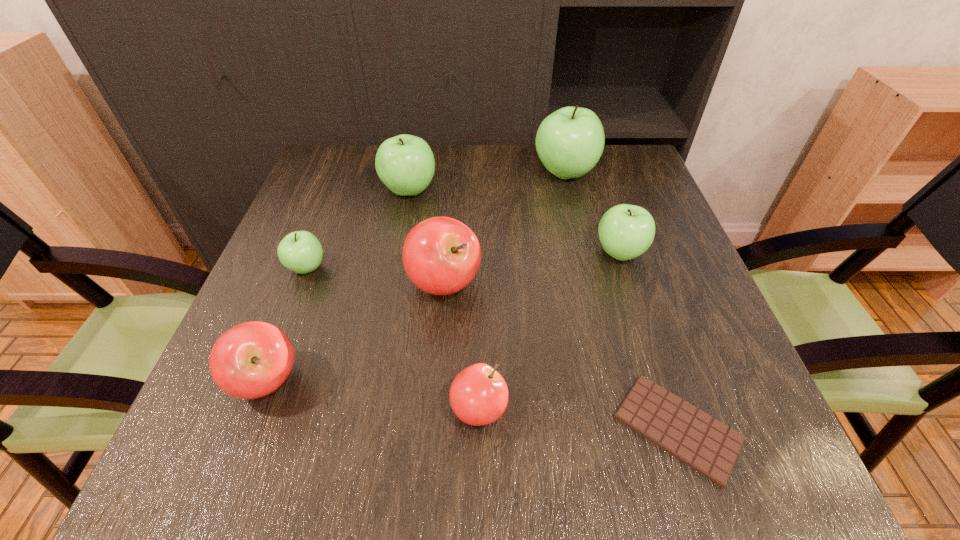
This screenshot has width=960, height=540. I want to click on free point between the second smallest green apple and the chocolate bar, so pyautogui.click(x=648, y=340).

At what (x,y) coordinates should I click in order to perform the action: click on free space between the third green apple from right to left and the tallest apple. Please return your answer as a coordinate pair (x, y). This screenshot has width=960, height=540. Looking at the image, I should click on (487, 181).

Where is `free space between the smallest red apple and the brown chocolate bar`? Image resolution: width=960 pixels, height=540 pixels. free space between the smallest red apple and the brown chocolate bar is located at coordinates pos(578,418).

At what (x,y) coordinates should I click in order to perform the action: click on vacant space that is in between the biggest red apple and the smallest red apple. Please return your answer as a coordinate pair (x, y). Looking at the image, I should click on (462, 346).

What are the coordinates of `free space between the biggest green apple and the second biggest green apple` in the screenshot? It's located at (487, 181).

Image resolution: width=960 pixels, height=540 pixels. I want to click on free space between the smallest red apple and the smallest green apple, so click(393, 339).

Where is `empty space that is in between the second smallest green apple and the farthest red apple`? empty space that is in between the second smallest green apple and the farthest red apple is located at coordinates (532, 268).

This screenshot has height=540, width=960. I want to click on the closest object relative to the smallest red apple, so tap(441, 255).

Choose which object is the seventh nearest neighbor to the smallest red apple. Please provide its 2D coordinates. Your answer should be formatted as a tuple, i.e. [(x, y)], where the tuple contains the x and y coordinates of a point satisfying the conditions above.

[(570, 141)]

This screenshot has height=540, width=960. What are the coordinates of `the fourth closest apple to the smallest red apple` in the screenshot? It's located at (300, 251).